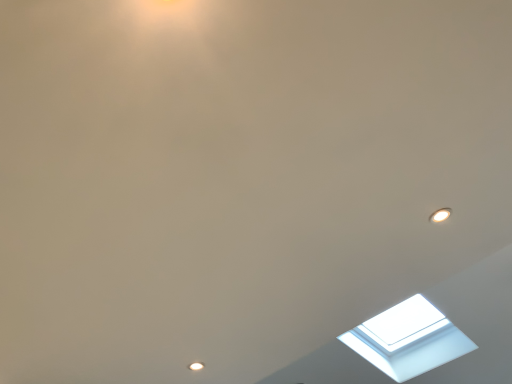
This screenshot has width=512, height=384. What do you see at coordinates (440, 215) in the screenshot?
I see `matte white droplight at upper right` at bounding box center [440, 215].

Find the location of a particular element. matte white droplight at upper right is located at coordinates (440, 215).

Image resolution: width=512 pixels, height=384 pixels. Find the location of `matte white droplight at upper right`. matte white droplight at upper right is located at coordinates (440, 215).